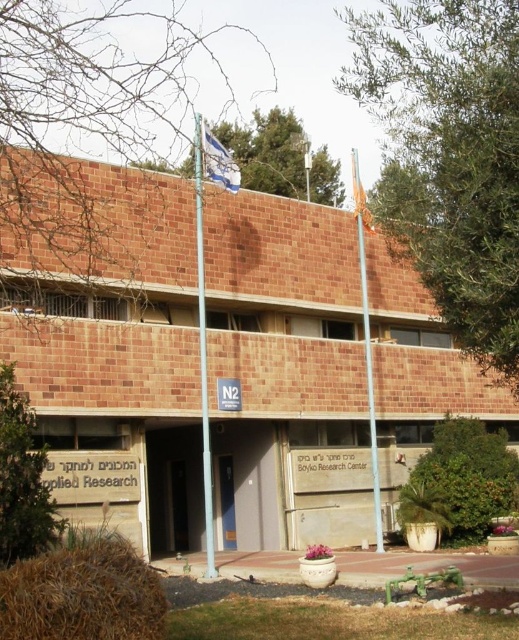
You are a delivery person with a cart that is 2 meters wide. You need to navigate between the metallic silver flag pole at center and the orange fabric flag at upper right to reach the entrance of the building. Can your cart fit through the space between them?

The distance between the metallic silver flag pole at center and the orange fabric flag at upper right is 2.74 meters. Since your cart is 2 meters wide, it can fit through the space as the distance is wider than the cart.

Looking at this image, you are a delivery person approaching the brown brick building at center and the orange fabric flag at upper right. Which object will you see first as you walk towards the building?

The orange fabric flag at upper right will be seen first because it is positioned above the brown brick building at center, making it visible from a greater distance.

You are a drone operator tasked with capturing aerial footage of the brown brick building at center and the orange fabric flag at upper right. Your drone has a camera with a 100mm lens that can focus on objects up to 50 meters away. If the distance between the building and the flag is 30 meters, can the drone capture both subjects in a single shot without moving the camera?

The brown brick building at center is wider than the orange fabric flag at upper right. Since the distance between them is 30 meters, which is within the 50 meters range of the camera lens, the drone can capture both subjects in a single shot without moving the camera.